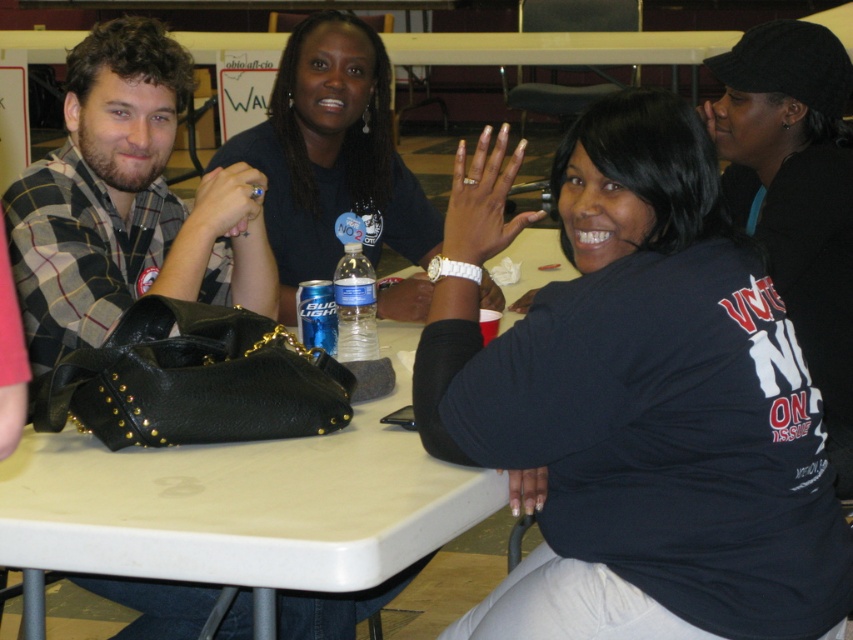
You are a photographer setting up for a group photo. You need to ensure that the black matte shirt at upper right and the matte black ring at upper center are both visible in the frame. Based on their positions, which object should you position closer to the left side of the camera frame to ensure both are included?

To include both the black matte shirt at upper right and the matte black ring at upper center in the frame, you should position the matte black ring at upper center closer to the left side of the camera frame since the black matte shirt at upper right is already to its right.

You are a photographer setting up for a group photo. You need to position two shirts for a backdrop. The plaid fabric shirt at left and the black fabric shirt at upper right are already placed. Based on their positions, which shirt should you move to the left to center them both?

The black fabric shirt at upper right should be moved to the left to center them both because it is currently positioned to the right of the plaid fabric shirt at left.

You are a photographer setting up for a group photo. You want to ensure that the black fabric shirt at upper right and the blue plastic water bottle at center are both visible in the frame. Based on their positions, which object is closer to the camera?

The black fabric shirt at upper right is in front of the blue plastic water bottle at center, so it is closer to the camera.